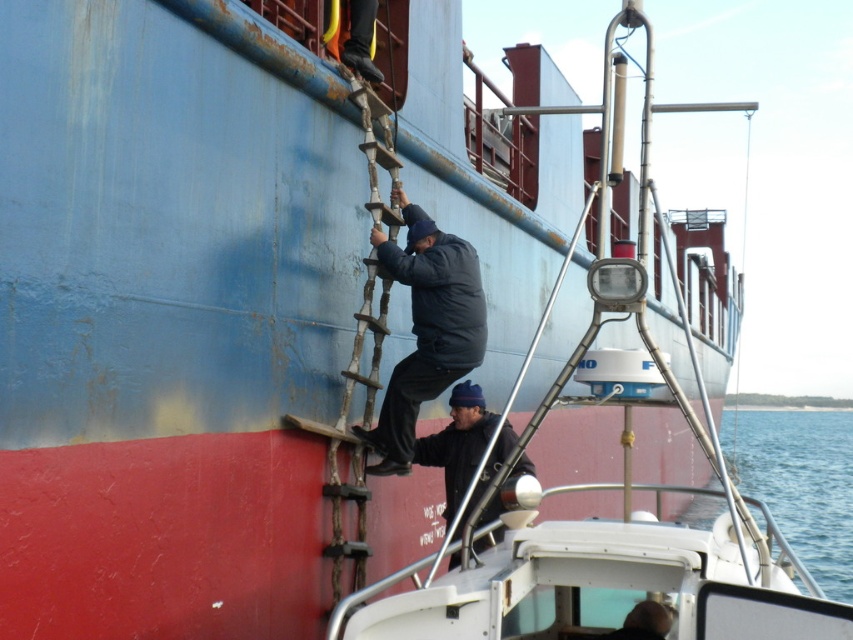
Question: Which point is farther to the camera?

Choices:
 (A) blue water at lower right
 (B) dark blue padded jacket at center
 (C) wooden at left
 (D) dark blue knit cap at center

Answer: (A)

Question: Which of the following is the closest to the observer?

Choices:
 (A) dark blue knit cap at center
 (B) blue water at lower right

Answer: (A)

Question: Which object is farther from the camera taking this photo?

Choices:
 (A) dark blue padded jacket at center
 (B) blue water at lower right
 (C) wooden at left

Answer: (B)

Question: Is wooden at left below dark blue knit cap at center?

Choices:
 (A) yes
 (B) no

Answer: (B)

Question: Does blue water at lower right appear over wooden at left?

Choices:
 (A) no
 (B) yes

Answer: (A)

Question: Considering the relative positions of dark blue padded jacket at center and dark blue knit cap at center in the image provided, where is dark blue padded jacket at center located with respect to dark blue knit cap at center?

Choices:
 (A) above
 (B) below

Answer: (A)